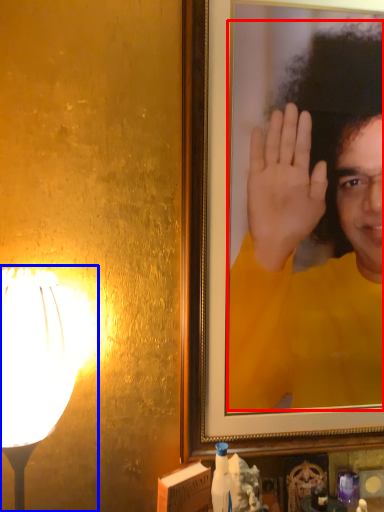
Question: Which object appears farthest to the camera in this image, man (highlighted by a red box) or lamp (highlighted by a blue box)?

Choices:
 (A) man
 (B) lamp

Answer: (A)